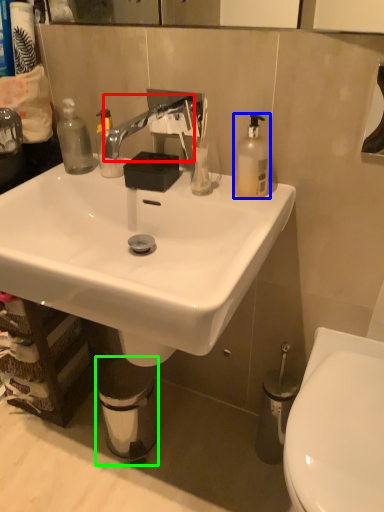
Question: Considering the real-world distances, which object is closest to faucet (highlighted by a red box)? bottle (highlighted by a blue box) or trash bin/can (highlighted by a green box).

Choices:
 (A) bottle
 (B) trash bin/can

Answer: (A)